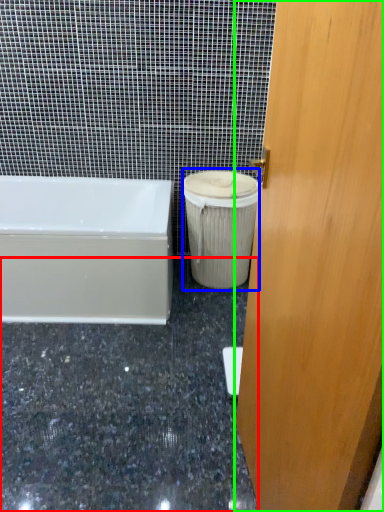
Question: Based on their relative distances, which object is farther from granite (highlighted by a red box)? Choose from garbage (highlighted by a blue box) and door (highlighted by a green box).

Choices:
 (A) garbage
 (B) door

Answer: (B)